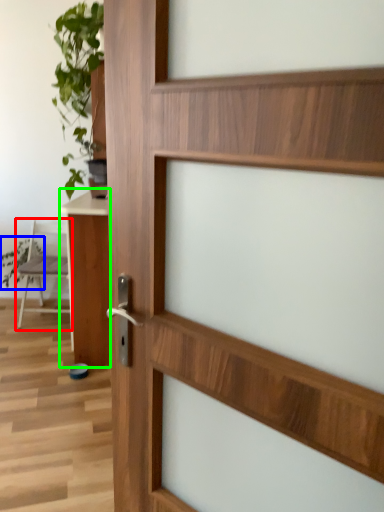
Question: Estimate the real-world distances between objects in this image. Which object is farther from chair (highlighted by a red box), plant (highlighted by a blue box) or table (highlighted by a green box)?

Choices:
 (A) plant
 (B) table

Answer: (B)